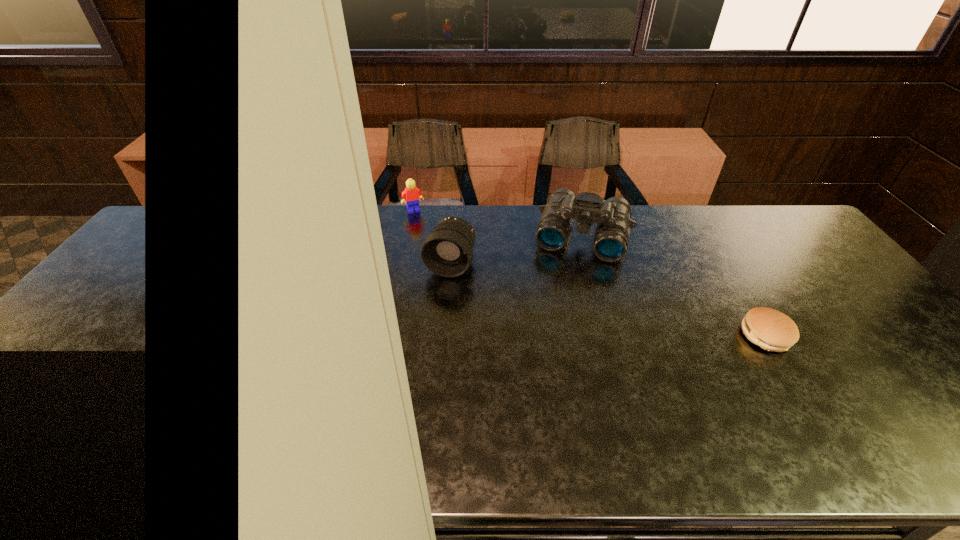
Image resolution: width=960 pixels, height=540 pixels. Find the location of `the shortest object`. the shortest object is located at coordinates (772, 330).

This screenshot has width=960, height=540. What are the coordinates of `the nearest object` in the screenshot? It's located at (772, 330).

The height and width of the screenshot is (540, 960). Find the location of `telephoto lens`. telephoto lens is located at coordinates (447, 251).

Identify the location of the second shortest object. The image size is (960, 540). (412, 194).

This screenshot has height=540, width=960. What are the coordinates of `the leftmost object` in the screenshot? It's located at (412, 194).

Locate an element on the screen. This screenshot has height=540, width=960. the second object from right to left is located at coordinates (612, 216).

Identify the location of vacant space located on the right of the shortest object. (859, 336).

The width and height of the screenshot is (960, 540). What are the coordinates of `free space located 0.050m at the front element of the telephoto lens` in the screenshot? It's located at (439, 293).

The image size is (960, 540). Find the location of `vacant position located at the front element of the telephoto lens`. vacant position located at the front element of the telephoto lens is located at coordinates (401, 389).

Locate an element on the screen. free point located 0.310m at the front element of the telephoto lens is located at coordinates (411, 366).